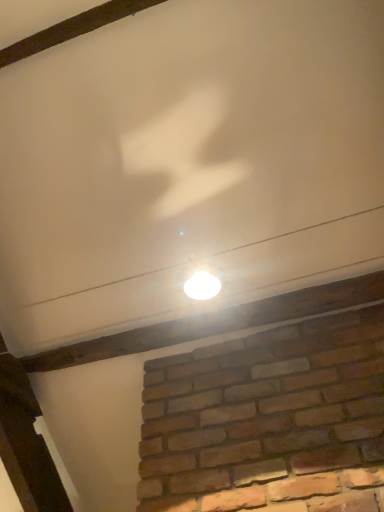
Find the location of a particular element. white glossy wire at upper center is located at coordinates (310, 238).

What do you see at coordinates (310, 238) in the screenshot? Image resolution: width=384 pixels, height=512 pixels. I see `white glossy wire at upper center` at bounding box center [310, 238].

You are a GUI agent. You are given a task and a screenshot of the screen. Output one action in this format:
    pyautogui.click(x=<x>, y=<y>)
    Task: Click on the white glossy wire at upper center
    This screenshot has height=512, width=384.
    Given the screenshot: What is the action you would take?
    pyautogui.click(x=310, y=238)